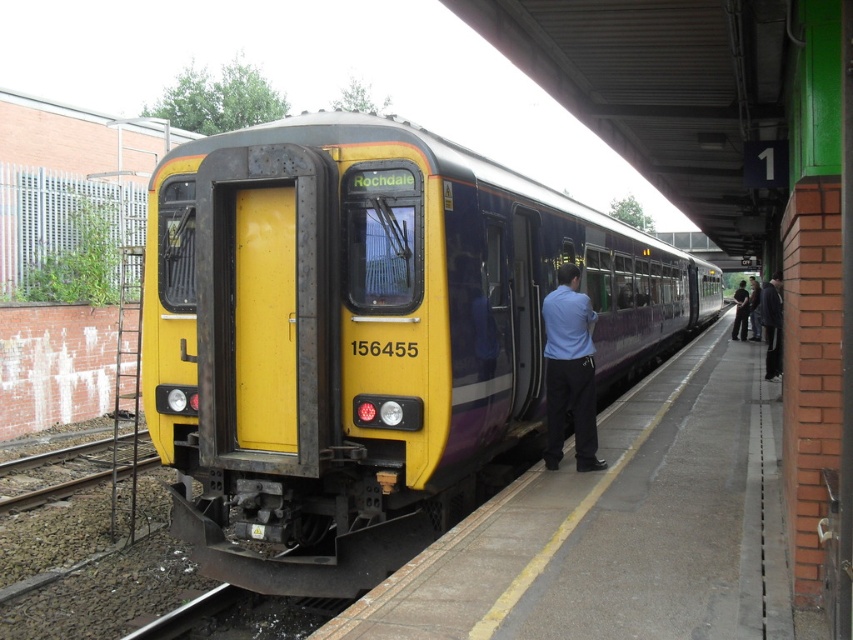
What do you see at coordinates (569, 371) in the screenshot?
I see `matte blue shirt at center` at bounding box center [569, 371].

Is matte blue shirt at center above dark blue jeans at right?

Incorrect, matte blue shirt at center is not positioned above dark blue jeans at right.

I want to click on matte blue shirt at center, so click(569, 371).

Who is shorter, concrete platform at center or dark blue jeans at right?

With less height is concrete platform at center.

Between point (608, 561) and point (772, 353), which one is positioned in front?

Point (608, 561)

Is point (526, 572) in front of point (769, 362)?

Yes, point (526, 572) is in front of point (769, 362).

Where is `concrete platform at center`? The width and height of the screenshot is (853, 640). concrete platform at center is located at coordinates (616, 529).

Is concrete platform at center to the right of dark gray fabric jacket at right from the viewer's perspective?

No, concrete platform at center is not to the right of dark gray fabric jacket at right.

Between point (375, 600) and point (763, 323), which one is positioned behind?

Positioned behind is point (763, 323).

Where is `concrete platform at center`? concrete platform at center is located at coordinates (616, 529).